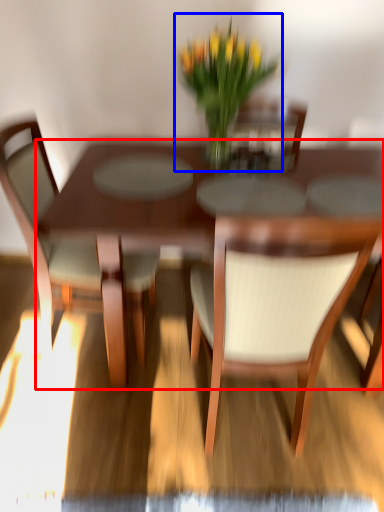
Question: Which object is further to the camera taking this photo, kitchen & dining room table (highlighted by a red box) or houseplant (highlighted by a blue box)?

Choices:
 (A) kitchen & dining room table
 (B) houseplant

Answer: (B)